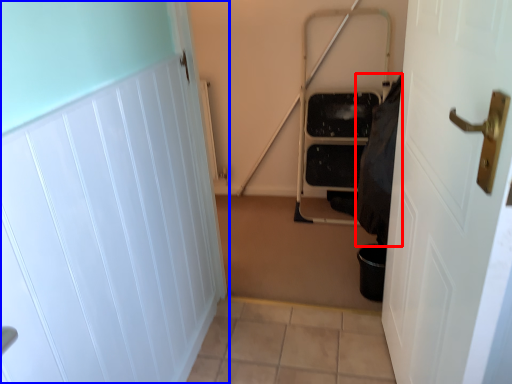
Question: Which point is further to the camera, material (highlighted by a red box) or door (highlighted by a blue box)?

Choices:
 (A) material
 (B) door

Answer: (A)